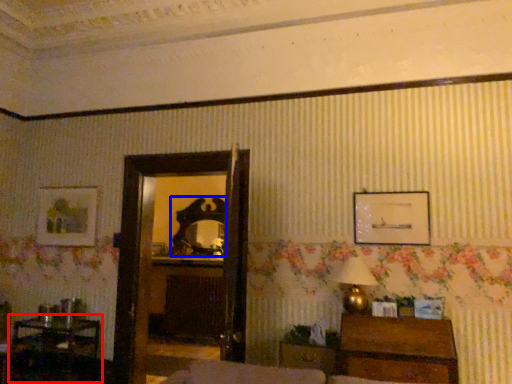
Question: Which object appears farthest to the camera in this image, table (highlighted by a red box) or mirror (highlighted by a blue box)?

Choices:
 (A) table
 (B) mirror

Answer: (B)